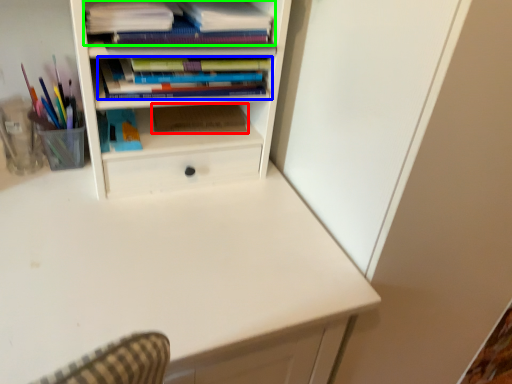
Question: Based on their relative distances, which object is farther from paperback book (highlighted by a red box)? Choose from book (highlighted by a blue box) and book (highlighted by a green box).

Choices:
 (A) book
 (B) book

Answer: (B)